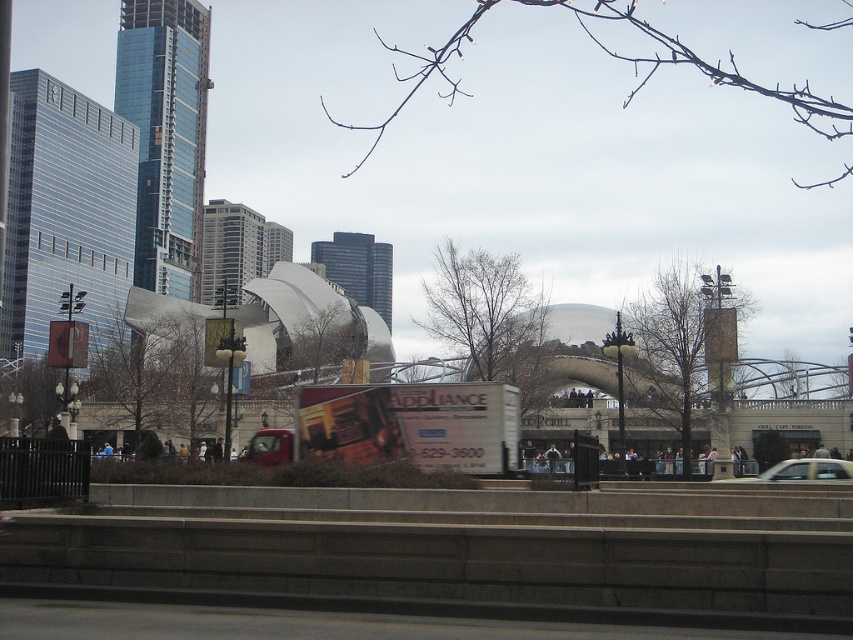
Question: Which point appears farthest from the camera in this image?

Choices:
 (A) (445, 397)
 (B) (799, 460)

Answer: (B)

Question: Does white matte billboard at center come in front of metallic red truck at center?

Choices:
 (A) yes
 (B) no

Answer: (B)

Question: Does white matte billboard at center appear under silver metallic car at center?

Choices:
 (A) no
 (B) yes

Answer: (A)

Question: Can you confirm if white matte billboard at center is thinner than metallic red truck at center?

Choices:
 (A) no
 (B) yes

Answer: (A)

Question: Which point is closer to the camera?

Choices:
 (A) white matte billboard at center
 (B) metallic red truck at center

Answer: (B)

Question: Based on their relative distances, which object is farther from the metallic red truck at center?

Choices:
 (A) silver metallic car at center
 (B) white matte billboard at center

Answer: (A)